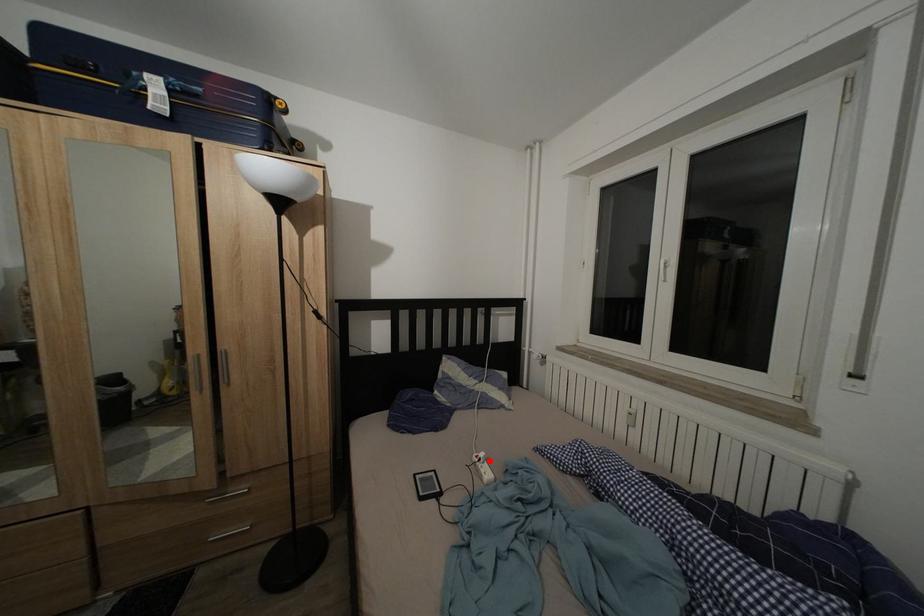
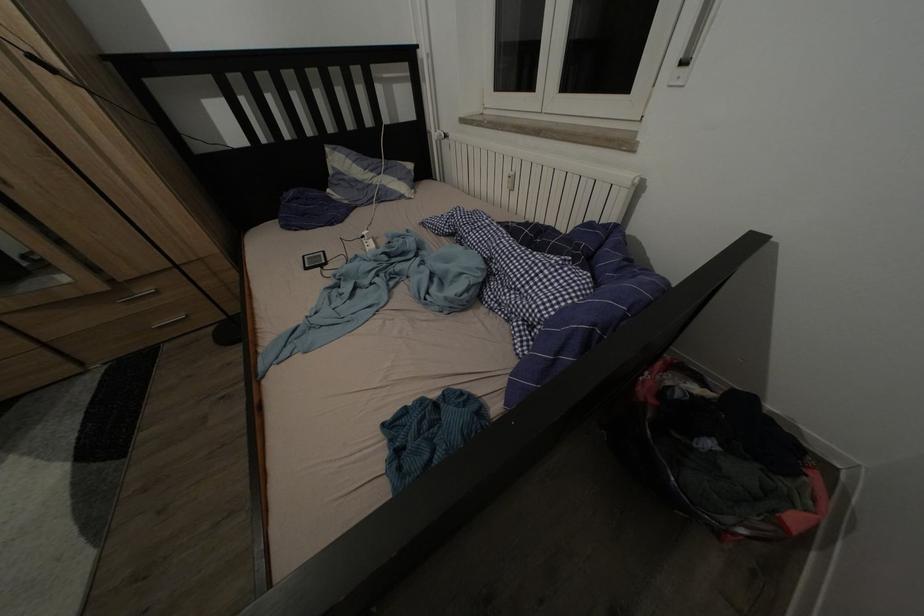
Find the pixel in the second image that matches the highlighted location in the first image.

(372, 238)